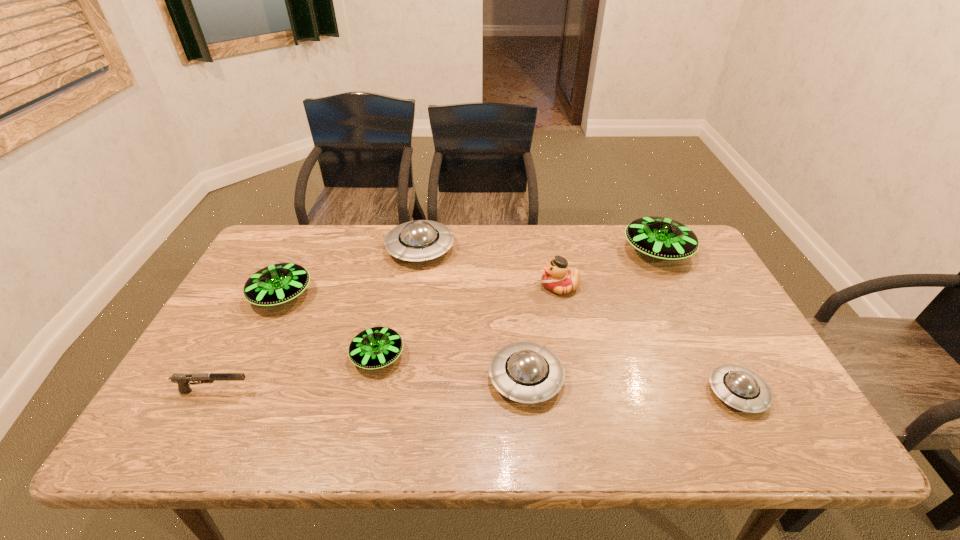
Find the location of a particular element. Image resolution: width=960 pixels, height=540 pixels. vacant space that satisfies the following two spatial constraints: 1. on the front side of the biggest gray saucer; 2. on the right side of the second gray saucer from right to left is located at coordinates (398, 379).

You are a GUI agent. You are given a task and a screenshot of the screen. Output one action in this format:
    pyautogui.click(x=<x>, y=<y>)
    Task: Click on the vacant space that satisfies the following two spatial constraints: 1. on the front side of the fourth saucer from left to right; 2. on the right side of the second green saucer from right to left
    This screenshot has width=960, height=540.
    Given the screenshot: What is the action you would take?
    coord(372,379)

Locate an element on the screen. Image resolution: width=960 pixels, height=540 pixels. free space in the image that satisfies the following two spatial constraints: 1. at the muzzle end of the gray gun; 2. on the right side of the smallest gray saucer is located at coordinates (214, 393).

Locate an element on the screen. This screenshot has width=960, height=540. vacant space that satisfies the following two spatial constraints: 1. on the front side of the third saucer from right to left; 2. on the left side of the biggest gray saucer is located at coordinates (398, 379).